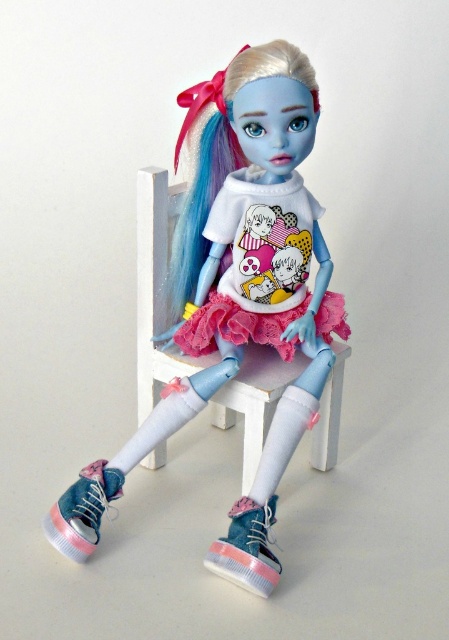
You are trying to decide if the white plastic chair at center can fit through the doorway that the pink canvas sneaker at lower left is near. Can it fit?

The white plastic chair at center might be wider than the pink canvas sneaker at lower left, so it might not fit through the doorway near the pink canvas sneaker at lower left.